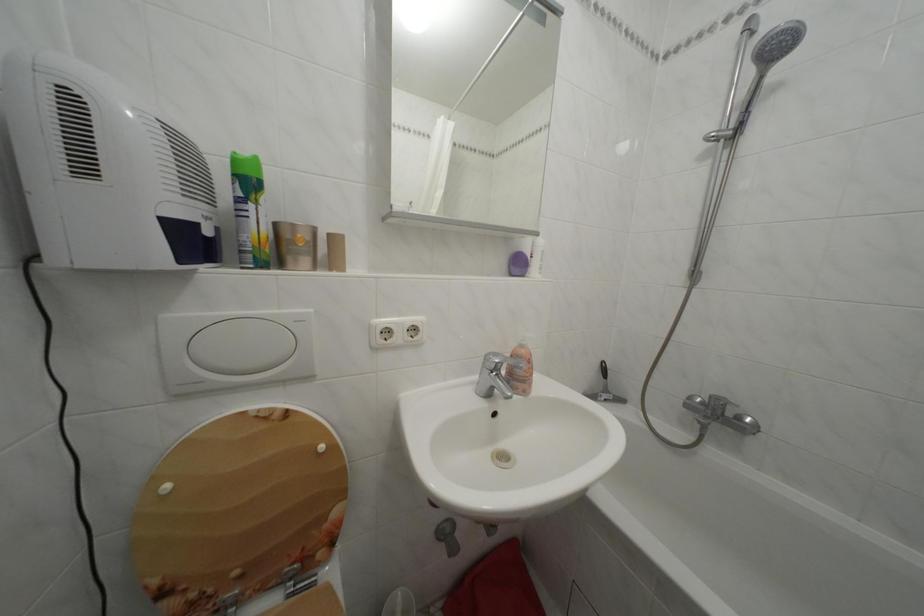
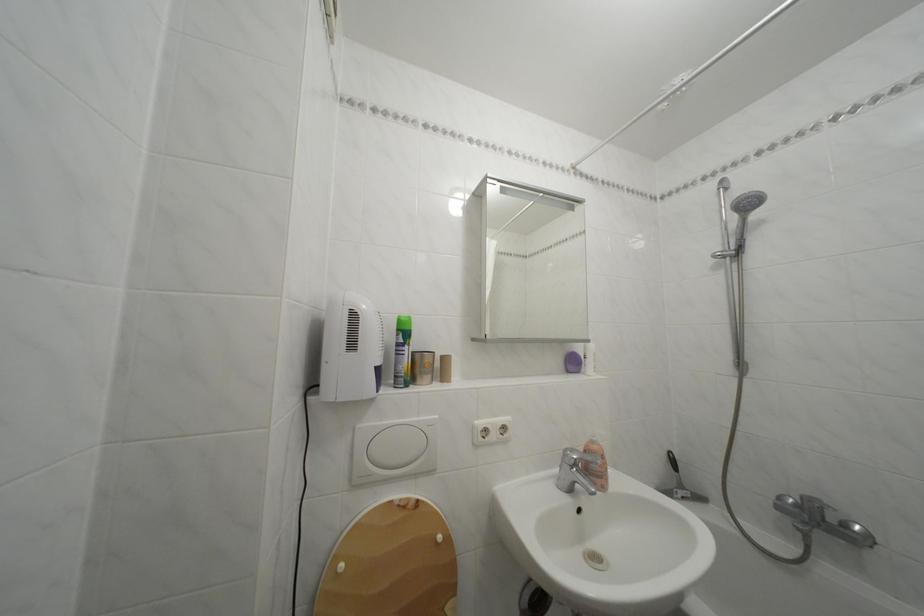
In the second image, find the point that corresponds to (174,323) in the first image.

(368, 432)